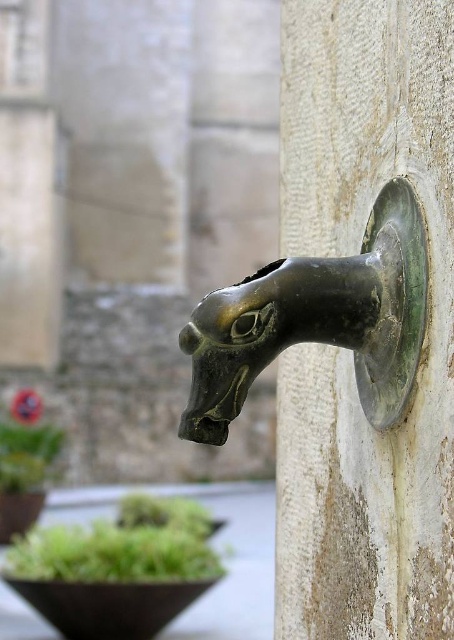
Based on the photo, who is higher up, bronze/rough horse head at center or green leafy plant at lower left?

bronze/rough horse head at center is above.

Which is more to the left, bronze/rough horse head at center or green leafy plant at lower left?

green leafy plant at lower left

Describe the element at coordinates (348, 352) in the screenshot. Image resolution: width=454 pixels, height=640 pixels. I see `bronze/rough horse head at center` at that location.

The height and width of the screenshot is (640, 454). In order to click on bronze/rough horse head at center in this screenshot , I will do `click(348, 352)`.

Is bronze/rough horse head at center below bronze/brass horse head at center?

Yes.

Image resolution: width=454 pixels, height=640 pixels. Describe the element at coordinates (348, 352) in the screenshot. I see `bronze/rough horse head at center` at that location.

This screenshot has width=454, height=640. Find the location of `bronze/rough horse head at center`. bronze/rough horse head at center is located at coordinates (348, 352).

Is bronze/brass horse head at center smaller than green leafy plant at lower left?

Yes, bronze/brass horse head at center is smaller than green leafy plant at lower left.

Who is positioned more to the right, bronze/brass horse head at center or green leafy plant at lower left?

bronze/brass horse head at center

Which is in front, point (325, 337) or point (36, 477)?

Positioned in front is point (325, 337).

Where is `bronze/brass horse head at center`? The height and width of the screenshot is (640, 454). bronze/brass horse head at center is located at coordinates (317, 321).